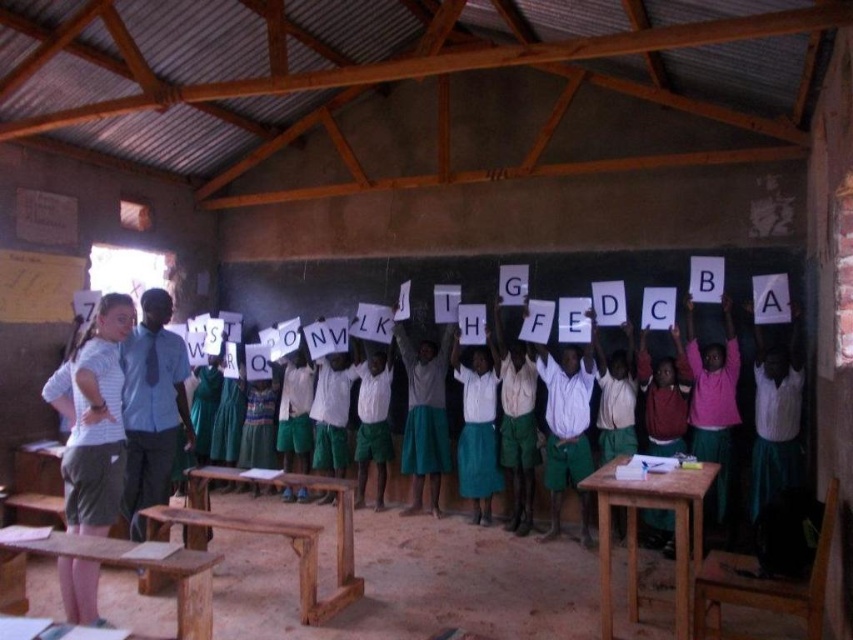
Question: Which of these objects is positioned farthest from the wooden table at center?

Choices:
 (A) green skirt at center
 (B) white striped shirt at left
 (C) white cotton shirt at center
 (D) wooden desk at lower left

Answer: (A)

Question: Among these points, which one is nearest to the camera?

Choices:
 (A) (207, 576)
 (B) (341, 266)
 (C) (351, 506)
 (D) (648, 362)

Answer: (A)

Question: Which of the following is the farthest from the observer?

Choices:
 (A) (74, 404)
 (B) (258, 262)
 (C) (339, 552)

Answer: (B)

Question: From the image, what is the correct spatial relationship of white striped shirt at left in relation to brown wooden table at center?

Choices:
 (A) above
 (B) below

Answer: (A)

Question: Is white paper letters at center positioned before wooden table at center?

Choices:
 (A) no
 (B) yes

Answer: (A)

Question: Is white paper letters at center to the left of wooden desk at lower left from the viewer's perspective?

Choices:
 (A) yes
 (B) no

Answer: (B)